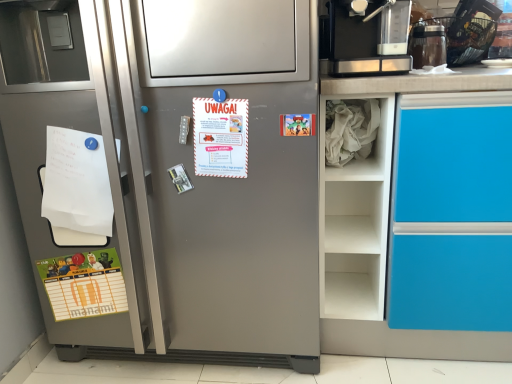
Question: From a real-world perspective, is cartoon paper at upper right, marked as the 2th postcard in a front-to-back arrangement, below satin silver refrigerator at left?

Choices:
 (A) no
 (B) yes

Answer: (A)

Question: From a real-world perspective, does cartoon paper at upper right, the first postcard when ordered from top to bottom, stand above satin silver refrigerator at left?

Choices:
 (A) no
 (B) yes

Answer: (B)

Question: Is cartoon paper at upper right, which appears as the 3th postcard when ordered from the bottom, looking in the opposite direction of satin silver refrigerator at left?

Choices:
 (A) yes
 (B) no

Answer: (A)

Question: Does cartoon paper at upper right, which appears as the third postcard when viewed from the left, have a larger size compared to satin silver refrigerator at left?

Choices:
 (A) yes
 (B) no

Answer: (B)

Question: Considering the relative sizes of cartoon paper at upper right, which appears as the third postcard when viewed from the left, and satin silver refrigerator at left in the image provided, is cartoon paper at upper right, which appears as the third postcard when viewed from the left, thinner than satin silver refrigerator at left?

Choices:
 (A) no
 (B) yes

Answer: (B)

Question: Are cartoon paper at upper right, the first postcard positioned from the right, and satin silver refrigerator at left beside each other?

Choices:
 (A) no
 (B) yes

Answer: (A)

Question: Can you confirm if black plastic basket at upper right, which appears as the 2th appliance when viewed from the left, is shorter than green matte poster at lower left, which appears as the third postcard when viewed from the right?

Choices:
 (A) yes
 (B) no

Answer: (A)

Question: Is black plastic basket at upper right, which appears as the 2th appliance when viewed from the left, to the left of green matte poster at lower left, which ranks as the first postcard in back-to-front order, from the viewer's perspective?

Choices:
 (A) no
 (B) yes

Answer: (A)

Question: Is the depth of black plastic basket at upper right, which is counted as the 1th appliance, starting from the right, less than that of green matte poster at lower left, which ranks as the first postcard in back-to-front order?

Choices:
 (A) yes
 (B) no

Answer: (B)

Question: Can you confirm if black plastic basket at upper right, which appears as the 2th appliance when viewed from the left, is positioned to the right of green matte poster at lower left, the 3th postcard in the front-to-back sequence?

Choices:
 (A) no
 (B) yes

Answer: (B)

Question: From the image's perspective, is black plastic basket at upper right, which is counted as the 1th appliance, starting from the right, located beneath green matte poster at lower left, the 3th postcard in the front-to-back sequence?

Choices:
 (A) yes
 (B) no

Answer: (B)

Question: From a real-world perspective, is black plastic basket at upper right, which is counted as the 1th appliance, starting from the right, physically below green matte poster at lower left, the 1th postcard from the left?

Choices:
 (A) no
 (B) yes

Answer: (A)

Question: From a real-world perspective, is white paper at center, the 2th postcard positioned from the right, under satin silver refrigerator at left?

Choices:
 (A) yes
 (B) no

Answer: (B)